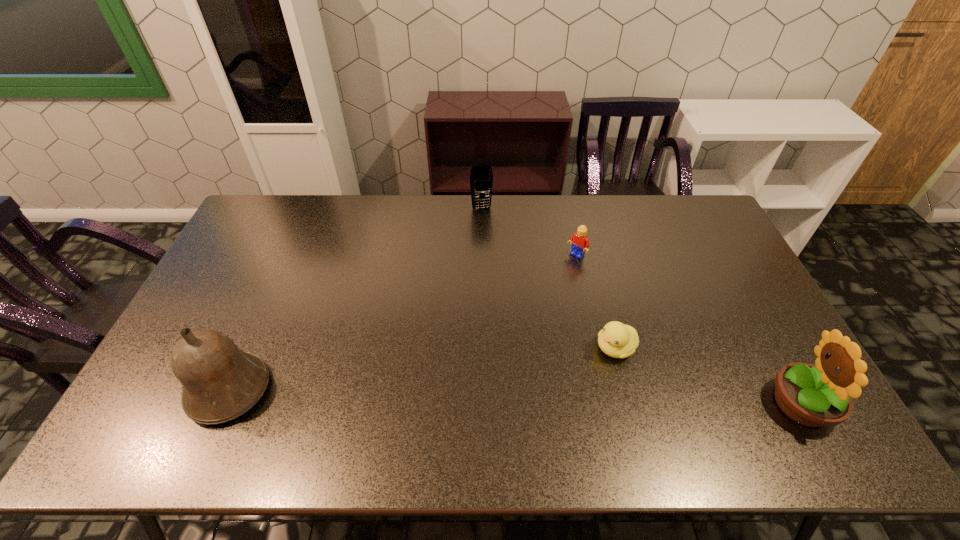
Identify the location of the leftmost object. The width and height of the screenshot is (960, 540). (220, 382).

This screenshot has height=540, width=960. What are the coordinates of `the rightmost object` in the screenshot? It's located at (817, 395).

Find the location of a particular element. the third tallest object is located at coordinates (481, 177).

At what (x,y) coordinates should I click in order to perform the action: click on cellular telephone. Please return your answer as a coordinate pair (x, y). Looking at the image, I should click on (481, 177).

Find the location of a particular element. Image resolution: width=960 pixels, height=540 pixels. the shortest object is located at coordinates (617, 340).

You are a GUI agent. You are given a task and a screenshot of the screen. Output one action in this format:
    pyautogui.click(x=<x>, y=<y>)
    Task: Click on the Lego
    This screenshot has height=540, width=960.
    Given the screenshot: What is the action you would take?
    pyautogui.click(x=580, y=242)

At what (x,y) coordinates should I click in order to perform the action: click on free space located 0.160m on the back of the leftmost object. Please return your answer as a coordinate pair (x, y). The image size is (960, 540). Looking at the image, I should click on (264, 311).

Image resolution: width=960 pixels, height=540 pixels. What are the coordinates of `free space located 0.160m on the face of the rightmost object` in the screenshot? It's located at (706, 403).

This screenshot has width=960, height=540. In order to click on vacant area situated on the face of the rightmost object in this screenshot , I will do `click(729, 403)`.

In order to click on blank space located on the face of the rightmost object in this screenshot , I will do `click(650, 403)`.